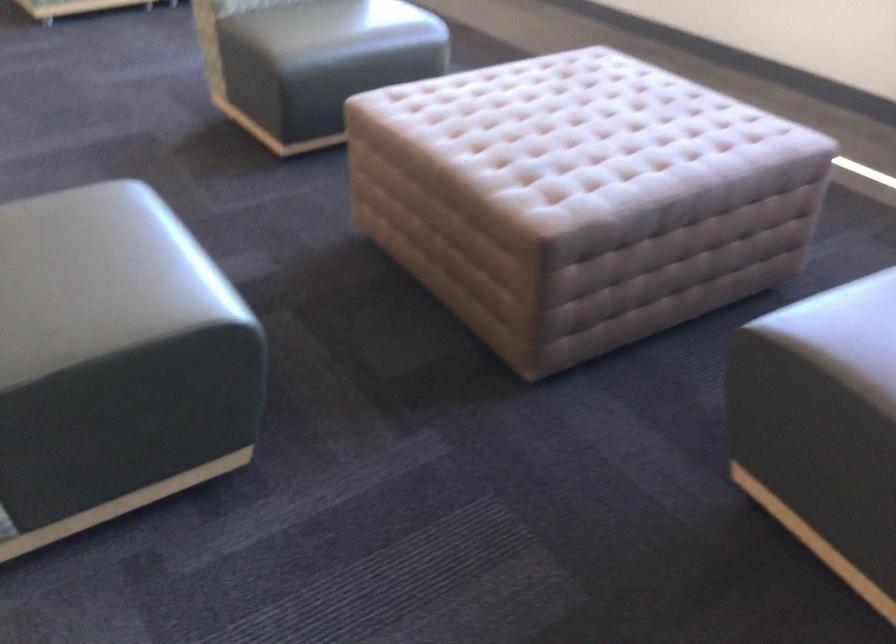
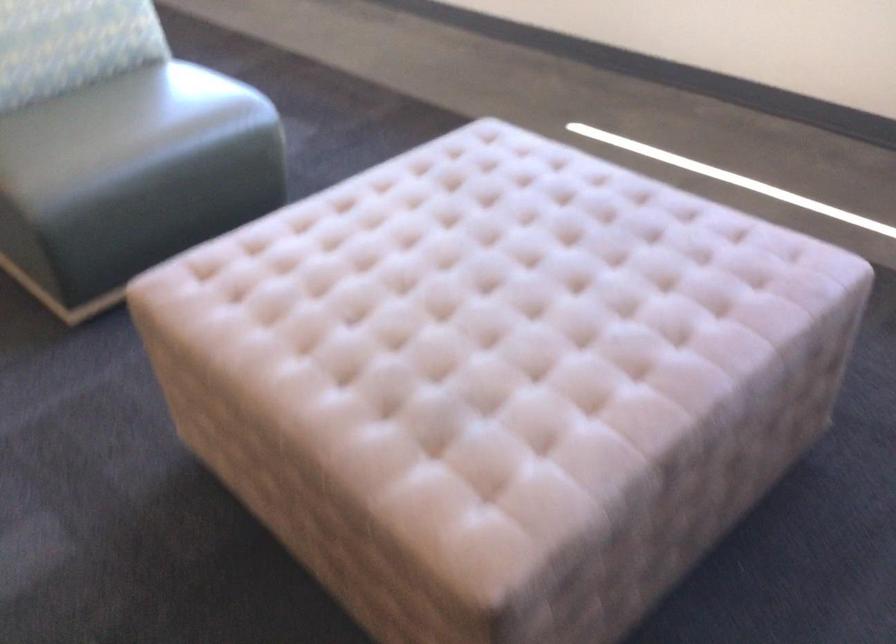
Question: The camera is either moving clockwise (left) or counter-clockwise (right) around the object. The first image is from the beginning of the video and the second image is from the end. Is the camera moving left or right when shooting the video?

Choices:
 (A) Left
 (B) Right

Answer: (A)